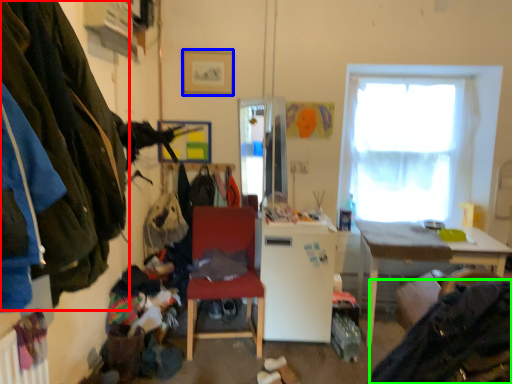
Question: Which is nearer to the clothing (highlighted by a red box)? picture frame (highlighted by a blue box) or clothing (highlighted by a green box).

Choices:
 (A) picture frame
 (B) clothing

Answer: (B)